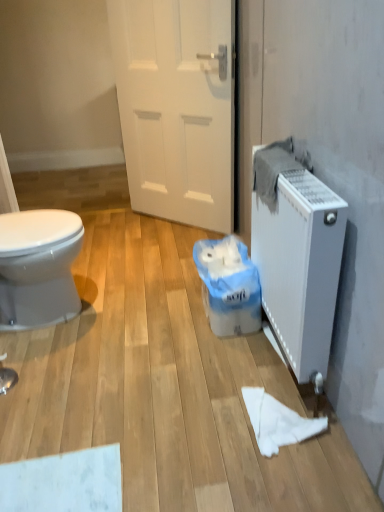
Question: From a real-world perspective, is white paper towel at lower center physically below white matte radiator at right?

Choices:
 (A) yes
 (B) no

Answer: (A)

Question: Is white paper towel at lower center in front of white matte radiator at right?

Choices:
 (A) yes
 (B) no

Answer: (B)

Question: Considering the relative positions of white paper towel at lower center and white matte radiator at right in the image provided, is white paper towel at lower center to the left of white matte radiator at right from the viewer's perspective?

Choices:
 (A) no
 (B) yes

Answer: (B)

Question: Considering the relative positions of white paper towel at lower center and white matte radiator at right in the image provided, is white paper towel at lower center behind white matte radiator at right?

Choices:
 (A) no
 (B) yes

Answer: (B)

Question: Considering the relative sizes of white paper towel at lower center and white matte radiator at right in the image provided, is white paper towel at lower center bigger than white matte radiator at right?

Choices:
 (A) yes
 (B) no

Answer: (B)

Question: Based on their positions, is white matte radiator at right located to the left or right of white matte door at center?

Choices:
 (A) left
 (B) right

Answer: (B)

Question: Does point (259, 257) appear closer or farther from the camera than point (135, 34)?

Choices:
 (A) closer
 (B) farther

Answer: (A)

Question: Which is correct: white matte radiator at right is inside white matte door at center, or outside of it?

Choices:
 (A) outside
 (B) inside

Answer: (A)

Question: Looking at their shapes, would you say white matte radiator at right is wider or thinner than white matte door at center?

Choices:
 (A) wide
 (B) thin

Answer: (B)

Question: In terms of size, does white paper towel at lower center appear bigger or smaller than white matte radiator at right?

Choices:
 (A) big
 (B) small

Answer: (B)

Question: In terms of width, does white paper towel at lower center look wider or thinner when compared to white matte radiator at right?

Choices:
 (A) thin
 (B) wide

Answer: (B)

Question: Considering their positions, is white paper towel at lower center located in front of or behind white matte radiator at right?

Choices:
 (A) front
 (B) behind

Answer: (B)

Question: From the image's perspective, is white paper towel at lower center located above or below white matte radiator at right?

Choices:
 (A) above
 (B) below

Answer: (B)

Question: From a real-world perspective, is white matte radiator at right physically located above or below white plastic bag at center?

Choices:
 (A) below
 (B) above

Answer: (B)

Question: Relative to white plastic bag at center, is white matte radiator at right in front or behind?

Choices:
 (A) front
 (B) behind

Answer: (A)